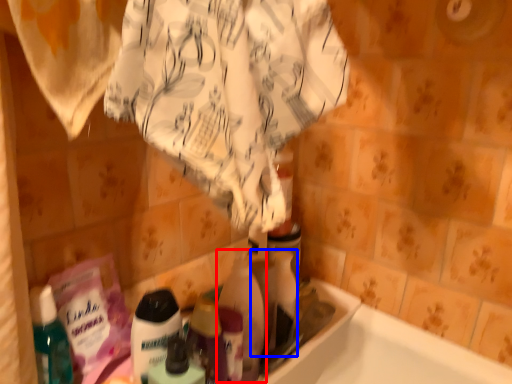
Question: Among these objects, which one is nearest to the camera, cleaning product (highlighted by a red box) or cleaning product (highlighted by a blue box)?

Choices:
 (A) cleaning product
 (B) cleaning product

Answer: (A)